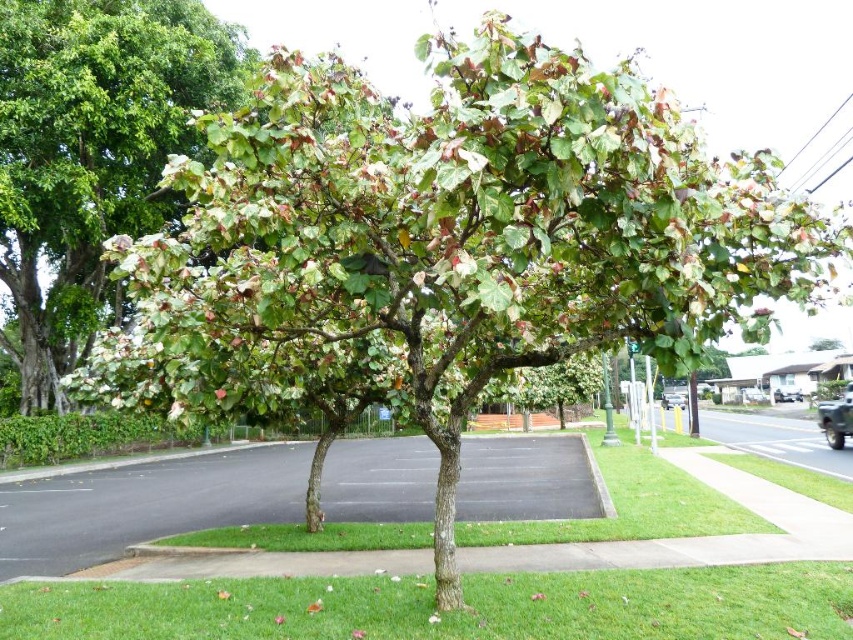
You are standing at the crosswalk on the road and looking towards the tree. There are two points marked in the image. Which point, point (178, 128) or point (741, 588), is closer to you?

Point (178, 128) is further to the camera than point (741, 588), so the closer point to you is point (741, 588).

You are a pedestrian standing on the sidewalk near the crosswalk. You see the green leafy tree at center and the green grass at center. Which one is positioned more to the left from your viewpoint?

The green leafy tree at center is positioned more to the left than the green grass at center.

Based on the scene description, which object occupies a larger area in the image? Please choose between the green leafy tree at center and the green grass at center.

The green leafy tree at center is bigger than the green grass at center, so the green leafy tree at center occupies a larger area in the image.